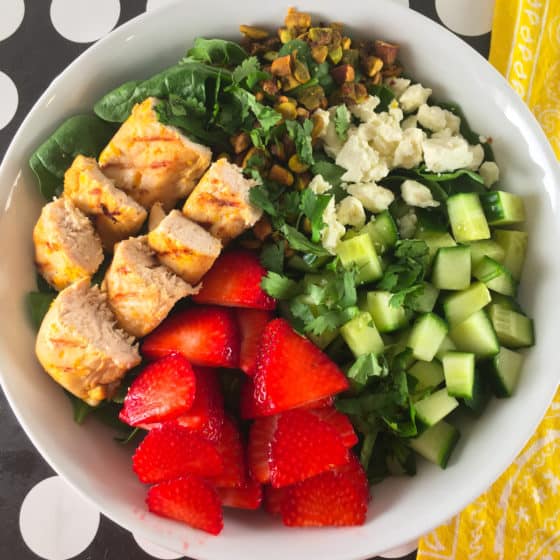
This screenshot has width=560, height=560. Identify the location of yellow tablecloth. (496, 520).